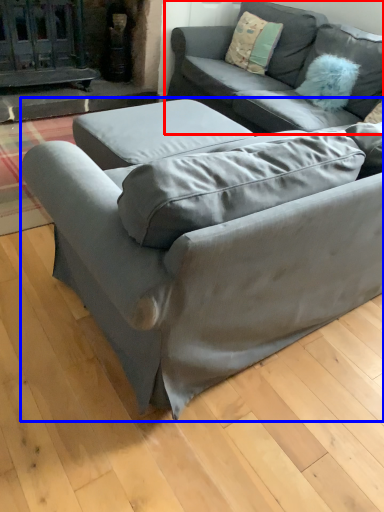
Question: Which of the following is the farthest to the observer, studio couch (highlighted by a red box) or studio couch (highlighted by a blue box)?

Choices:
 (A) studio couch
 (B) studio couch

Answer: (A)